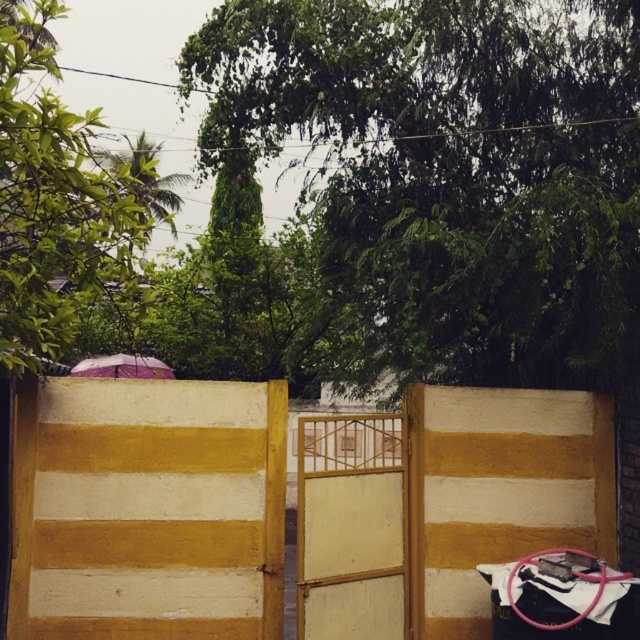
Question: Is wooden gate at center further to the viewer compared to pink fabric umbrella at upper center?

Choices:
 (A) no
 (B) yes

Answer: (A)

Question: Which point is farther to the camera?

Choices:
 (A) (296, 448)
 (B) (76, 369)

Answer: (B)

Question: Among these objects, which one is farthest from the camera?

Choices:
 (A) wooden gate at center
 (B) pink fabric umbrella at upper center

Answer: (B)

Question: Which point is closer to the camera?

Choices:
 (A) (376, 467)
 (B) (145, 371)

Answer: (A)

Question: Is the position of wooden gate at center less distant than that of pink fabric umbrella at upper center?

Choices:
 (A) yes
 (B) no

Answer: (A)

Question: Does wooden gate at center appear on the left side of pink fabric umbrella at upper center?

Choices:
 (A) yes
 (B) no

Answer: (B)